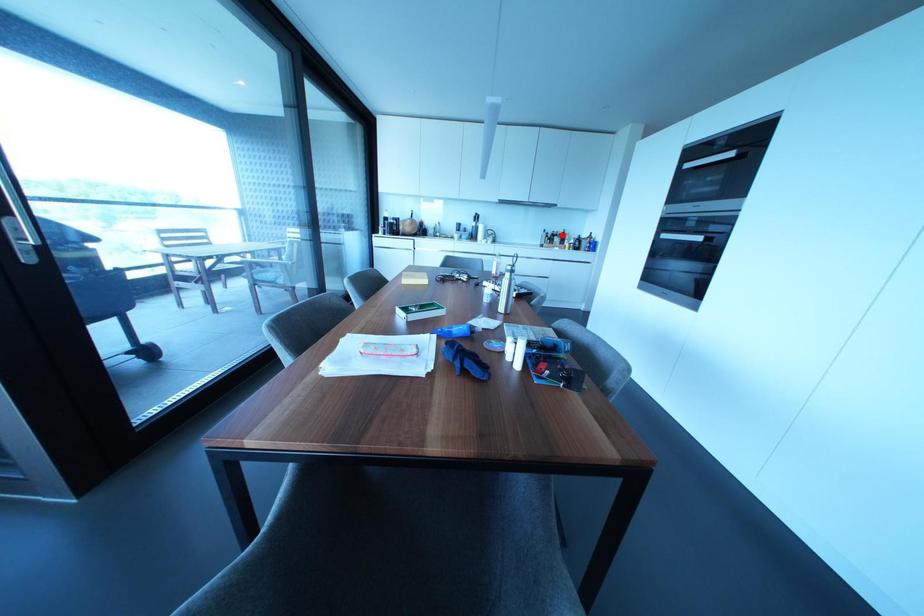
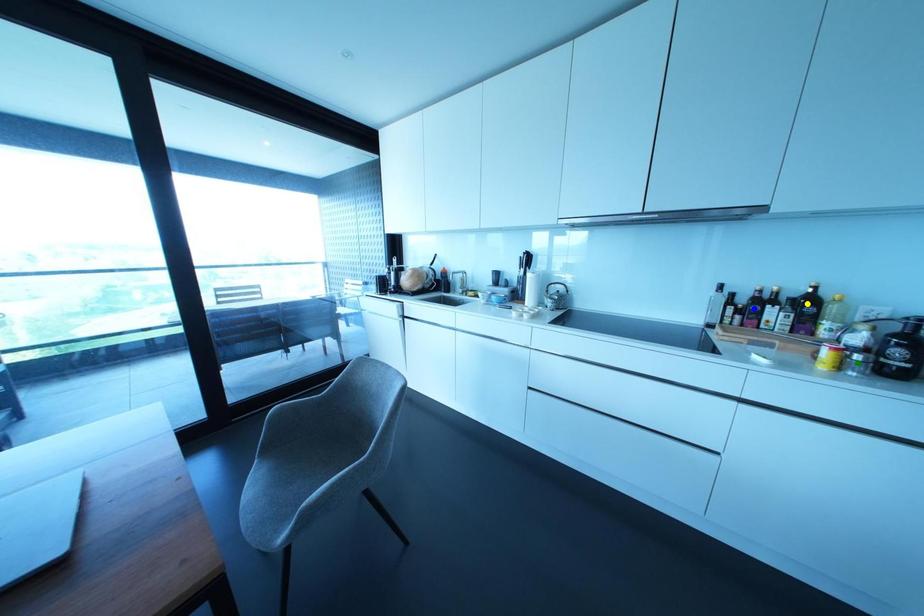
Question: I am providing you with two images of the same scene from different viewpoints. A red point is marked on the first image. You are given multiple points on the second image. Which point in image 2 is actually the same real-world point as the red point in image 1?

Choices:
 (A) blue point
 (B) green point
 (C) yellow point

Answer: (C)